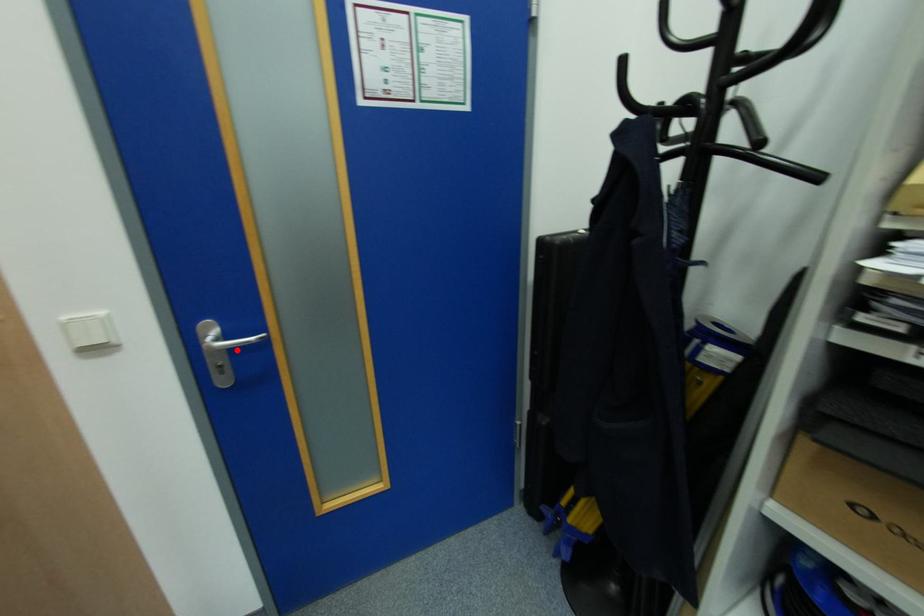
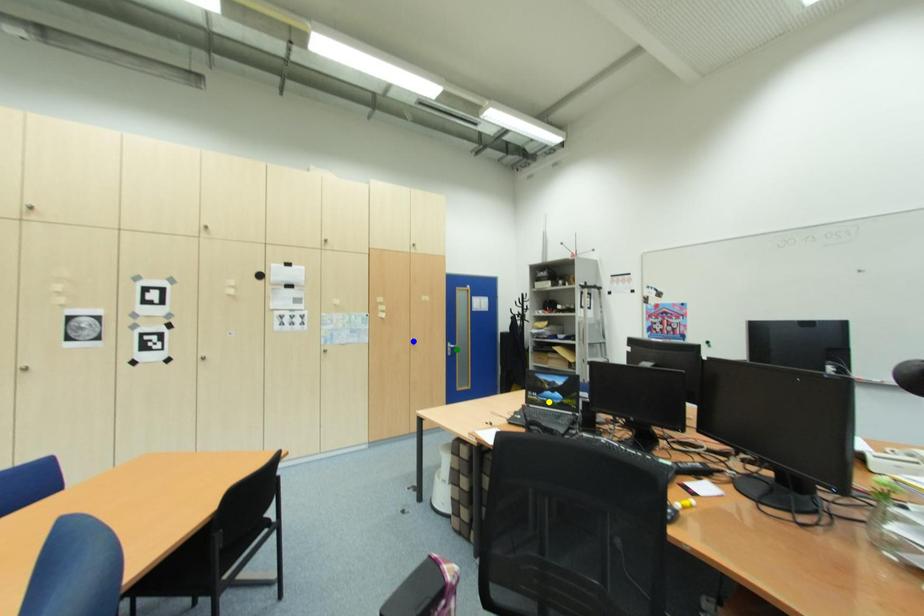
Question: I am providing you with two images of the same scene from different viewpoints. A red point is marked on the first image. You are given multiple points on the second image. Which point in image 2 is actually the same real-world point as the red point in image 1?

Choices:
 (A) green point
 (B) yellow point
 (C) blue point

Answer: (A)